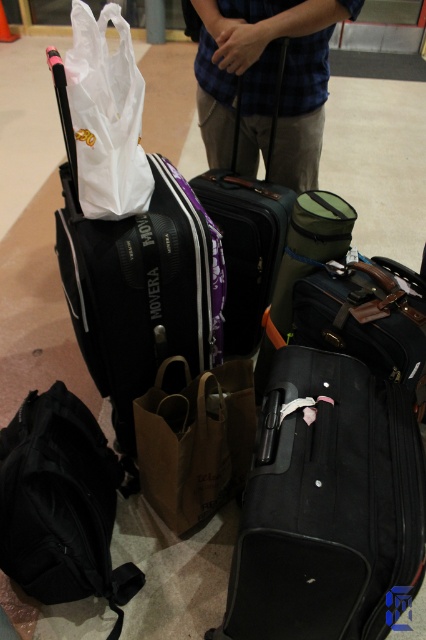
Can you confirm if blue plaid shirt at upper center is positioned to the right of matte black suitcase at center?

Yes, blue plaid shirt at upper center is to the right of matte black suitcase at center.

Does blue plaid shirt at upper center have a lesser height compared to matte black suitcase at center?

Yes, blue plaid shirt at upper center is shorter than matte black suitcase at center.

The image size is (426, 640). I want to click on blue plaid shirt at upper center, so click(265, 81).

From the picture: Can you confirm if black matte suitcase at lower right is smaller than brown paper bag at center?

No, black matte suitcase at lower right is not smaller than brown paper bag at center.

Between black matte suitcase at lower right and brown paper bag at center, which one is positioned higher?

brown paper bag at center is higher up.

Where is `black matte suitcase at lower right`? black matte suitcase at lower right is located at coordinates (328, 506).

You are a GUI agent. You are given a task and a screenshot of the screen. Output one action in this format:
    pyautogui.click(x=<x>, y=<y>)
    Task: Click on the black matte suitcase at lower right
    
    Given the screenshot: What is the action you would take?
    pyautogui.click(x=328, y=506)

Can you confirm if white matte plastic bag at upper left is thinner than matte black suitcase at center?

Yes.

Which is in front, point (104, 128) or point (271, 234)?

Point (104, 128) is in front.

The height and width of the screenshot is (640, 426). Find the location of `white matte plastic bag at upper left`. white matte plastic bag at upper left is located at coordinates (106, 116).